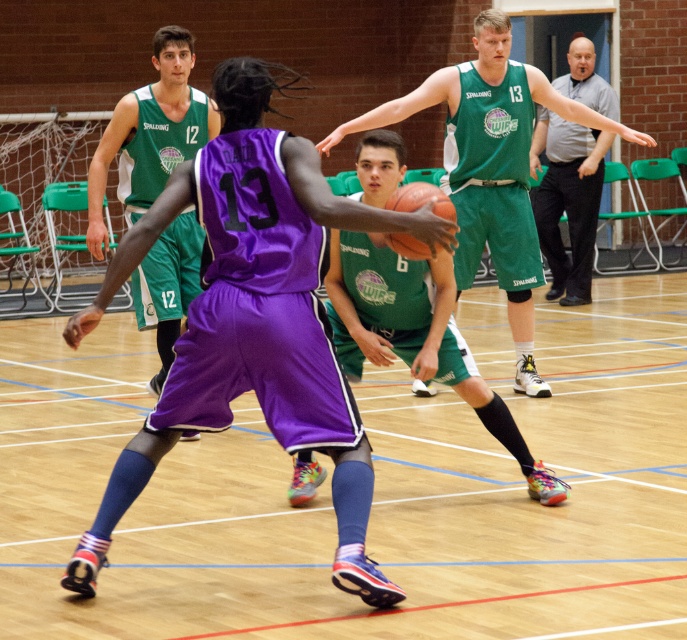
You are a spectator at the basketball game and want to take a photo of both the purple matte basketball player at center and the gray casual shirt at upper right. Which object should you pan your camera to the left to capture first?

The purple matte basketball player at center is positioned on the left side of gray casual shirt at upper right, so you should pan your camera to the left to capture the purple matte basketball player at center first.